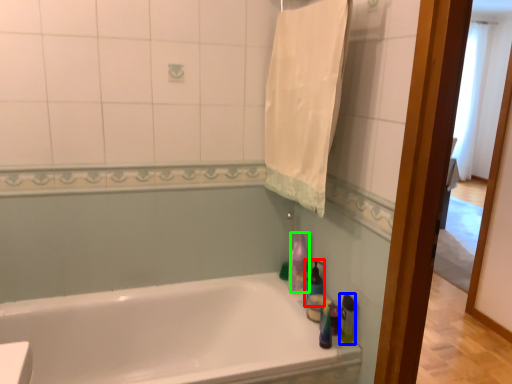
Question: Which object is the farthest from cleaning product (highlighted by a red box)? Choose among these: cleaning product (highlighted by a blue box) or cleaning product (highlighted by a green box).

Choices:
 (A) cleaning product
 (B) cleaning product

Answer: (A)